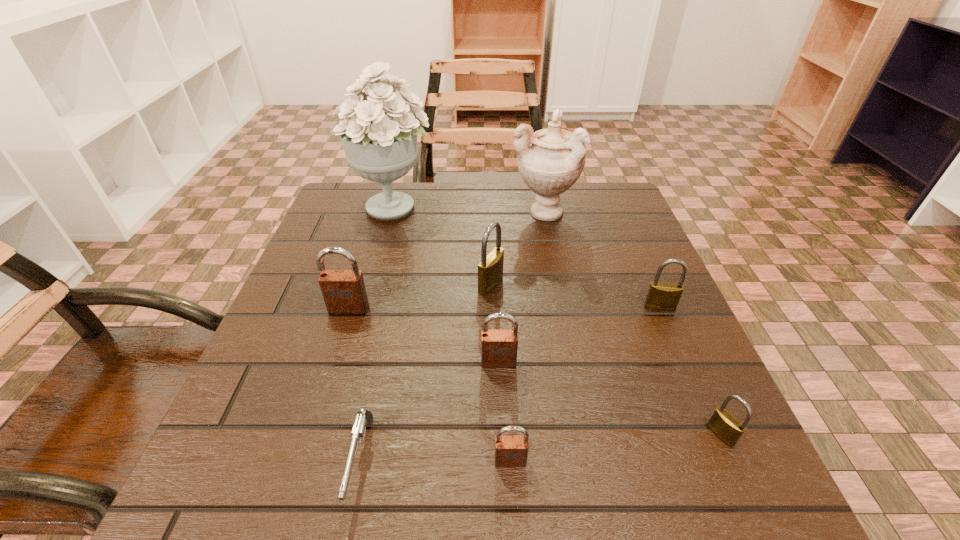
Where is `bouquet`? Image resolution: width=960 pixels, height=540 pixels. bouquet is located at coordinates [382, 147].

I want to click on green bouquet, so click(382, 147).

In order to click on the third object from right to left in this screenshot , I will do `click(550, 161)`.

Where is `urn`? This screenshot has width=960, height=540. urn is located at coordinates (550, 161).

Locate an element on the screen. This screenshot has height=540, width=960. the third farthest object is located at coordinates (490, 270).

At what (x,y) coordinates should I click in order to perform the action: click on the farthest brass padlock. Please return your answer as a coordinate pair (x, y). Image resolution: width=960 pixels, height=540 pixels. Looking at the image, I should click on (490, 270).

This screenshot has width=960, height=540. What are the coordinates of `the farthest brown padlock` in the screenshot? It's located at (344, 292).

Find the location of `the leftmost brown padlock`. the leftmost brown padlock is located at coordinates (344, 292).

Where is `the second biggest brass padlock`? the second biggest brass padlock is located at coordinates (661, 296).

Locate an element on the screen. Image resolution: width=960 pixels, height=540 pixels. the second smallest brown padlock is located at coordinates (499, 348).